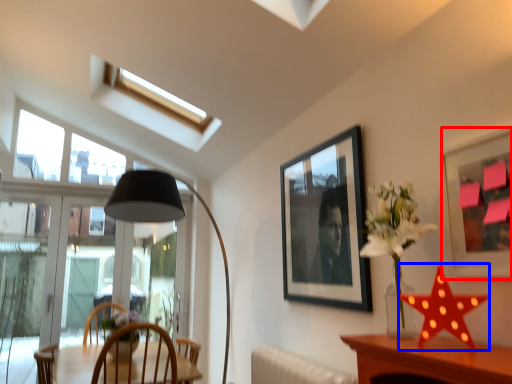
Question: Which point is further to the camera, picture frame (highlighted by a red box) or star (highlighted by a blue box)?

Choices:
 (A) picture frame
 (B) star

Answer: (B)